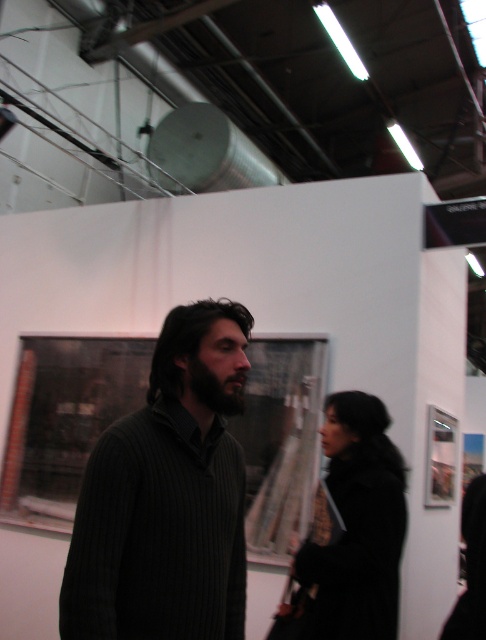
You are an art gallery attendant who needs to determine if the dark ribbed sweater at center and the black wool coat at center can fit side by side on a display mannequin that is 1.2 meters wide. Based on their widths, can they fit together?

The dark ribbed sweater at center has a lesser width compared to black wool coat at center. If the combined width of both items is less than or equal to 1.2 meters, they can fit. However, without specific measurements, it is impossible to confirm definitively.

You are standing in an art gallery and see the man in the dark ribbed sweater at center. If you want to approach him, which direction should you move relative to the point marked at coordinate (168, 497)?

Since the dark ribbed sweater at center is represented by point (168, 497), you should move towards that coordinate to approach him.

Looking at this image, you are an art gallery security guard who needs to check the distance between the dark ribbed sweater at center and the black wool coat at center. Which one is higher up in the image?

The dark ribbed sweater at center is above the black wool coat at center, so it is higher up in the image.